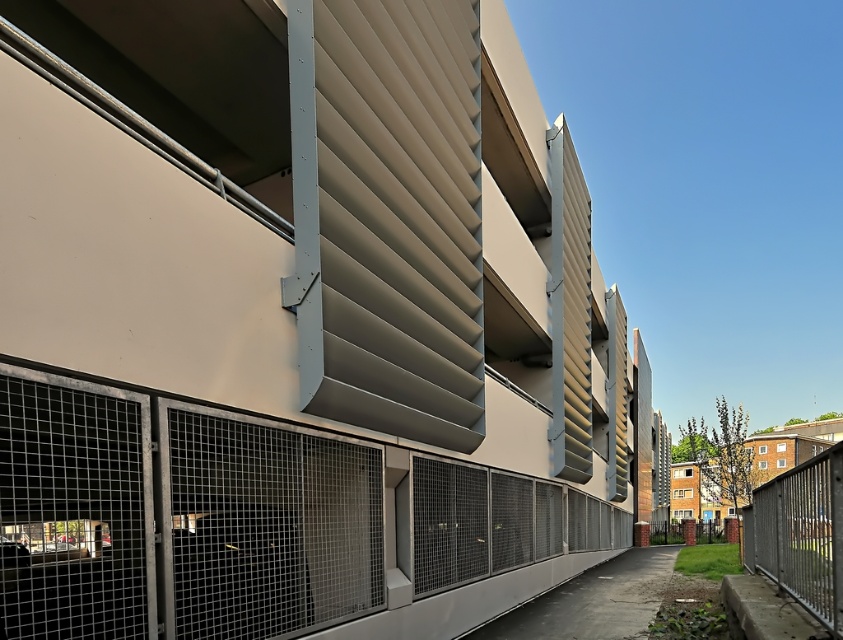
Does metal mesh fence at center have a greater height compared to metallic silver fence at lower right?

Correct, metal mesh fence at center is much taller as metallic silver fence at lower right.

Who is positioned more to the left, metal mesh fence at center or metallic silver fence at lower right?

Positioned to the left is metal mesh fence at center.

Is point (586, 552) closer to camera compared to point (811, 576)?

No, it is behind (811, 576).

The width and height of the screenshot is (843, 640). In order to click on metal mesh fence at center in this screenshot , I will do tap(256, 524).